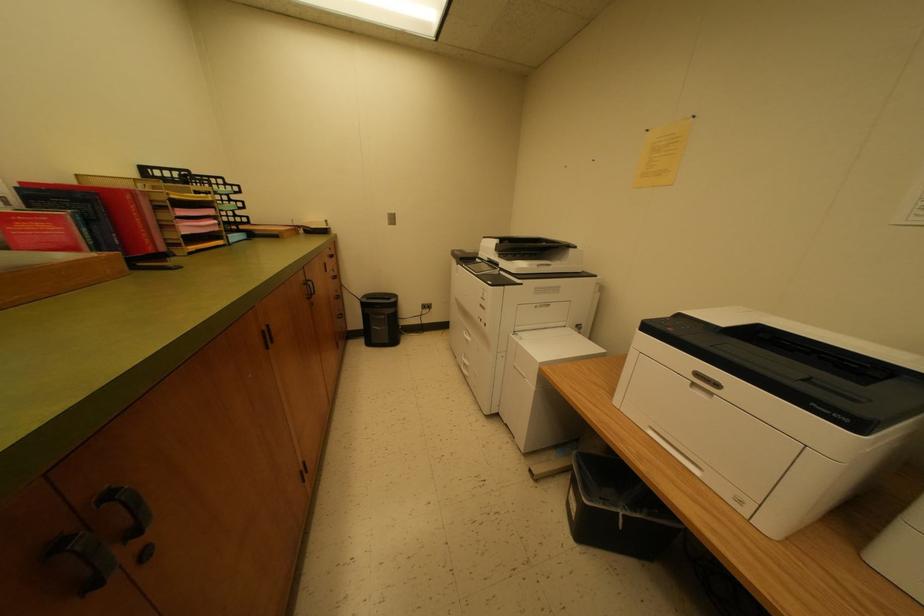
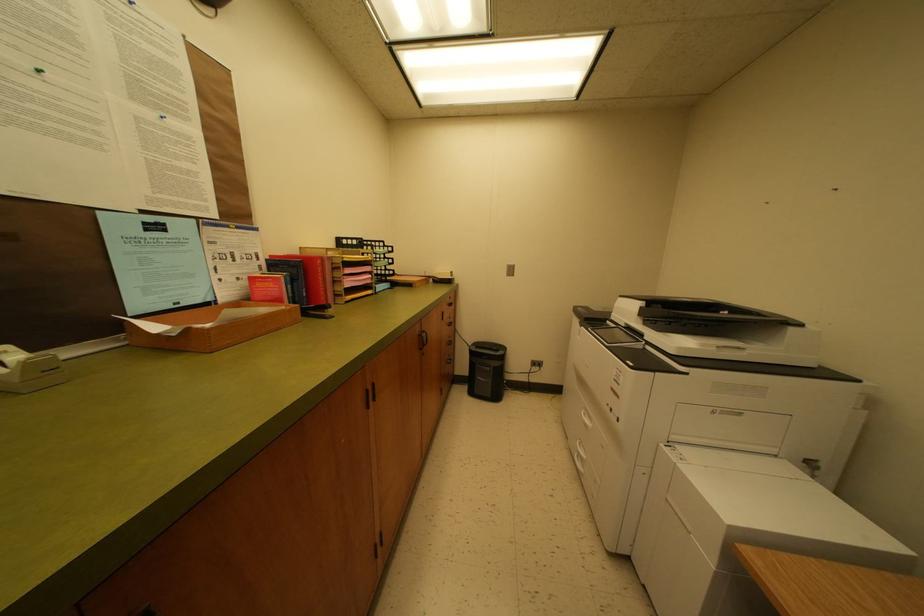
Question: The first image is from the beginning of the video and the second image is from the end. How did the camera likely rotate when shooting the video?

Choices:
 (A) Left
 (B) Right
 (C) Up
 (D) Down

Answer: (A)